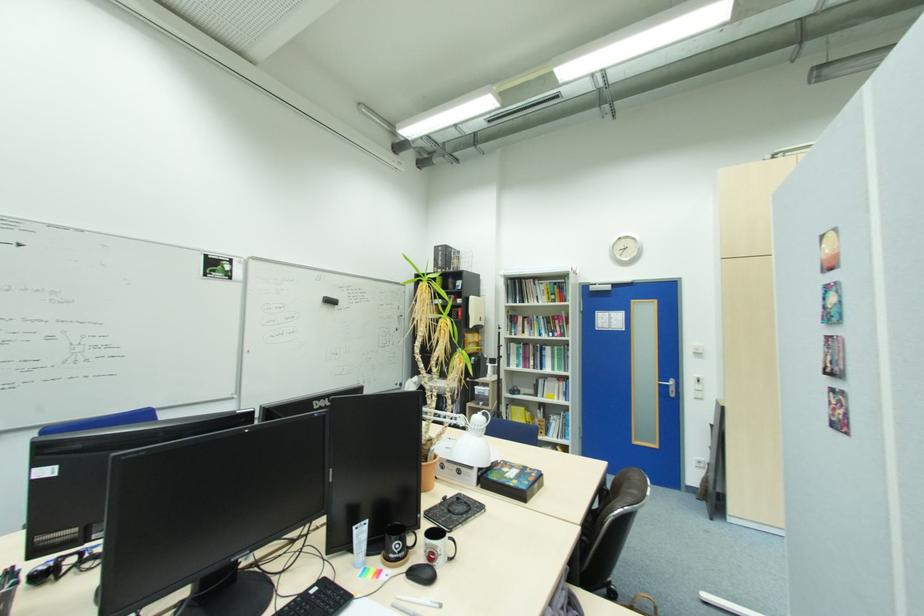
The height and width of the screenshot is (616, 924). Find the location of `white dispenser lever`. white dispenser lever is located at coordinates (670, 386).